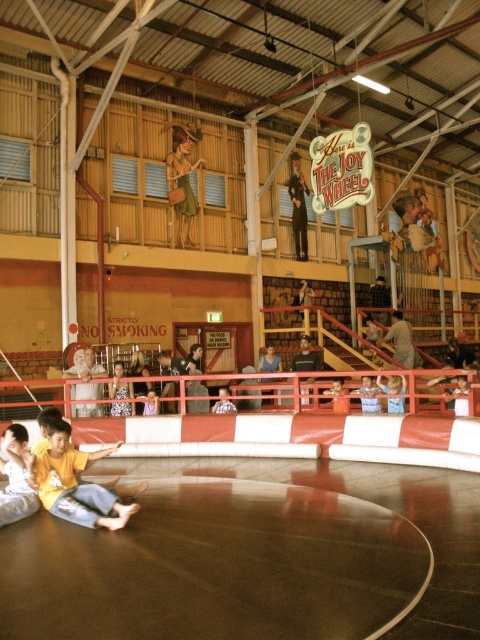
Which is behind, point (84, 362) or point (377, 381)?

The point (84, 362) is more distant.

Image resolution: width=480 pixels, height=640 pixels. Describe the element at coordinates (86, 376) in the screenshot. I see `matte white shirt at lower left` at that location.

Where is `matte white shirt at lower left`? This screenshot has height=640, width=480. matte white shirt at lower left is located at coordinates (86, 376).

Between matte brown hat at upper center and yellow fabric shirt at lower left, which one is positioned higher?

matte brown hat at upper center

How distant is matte brown hat at upper center from yellow fabric shirt at lower left?

The distance of matte brown hat at upper center from yellow fabric shirt at lower left is 7.76 meters.

The image size is (480, 640). Identify the location of matte brown hat at upper center. (182, 177).

Consider the image. Can you confirm if yellow matte shirt at lower left is positioned to the right of yellow fabric boy at lower left?

Yes, yellow matte shirt at lower left is to the right of yellow fabric boy at lower left.

Between point (99, 499) and point (14, 499), which one is positioned in front?

Point (99, 499)

Where is `yellow matte shirt at lower left`? This screenshot has height=640, width=480. yellow matte shirt at lower left is located at coordinates (75, 483).